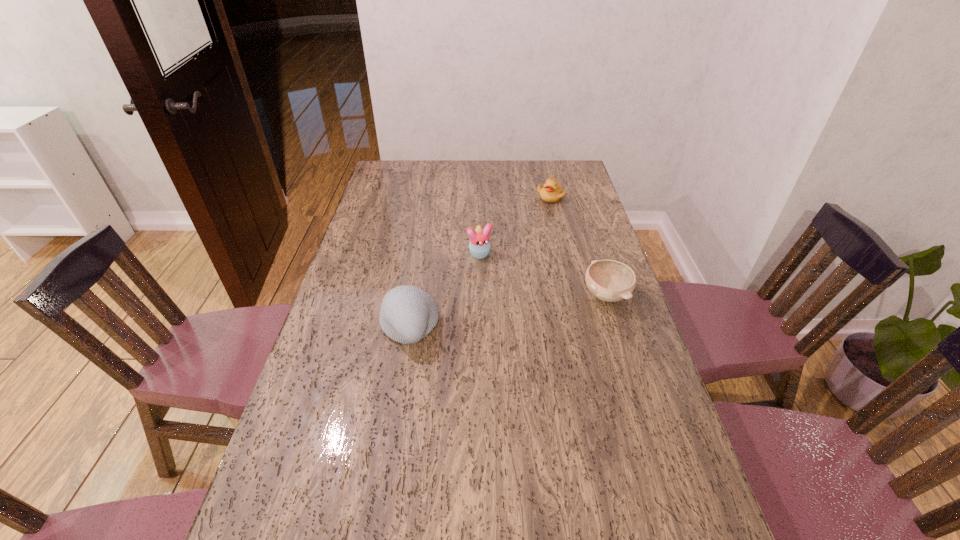
Where is `free space at the far right corner`? This screenshot has width=960, height=540. free space at the far right corner is located at coordinates (571, 160).

Identify the location of free space between the beanie and the duckling. This screenshot has height=540, width=960. (480, 262).

Locate an element on the screen. Image resolution: width=960 pixels, height=540 pixels. vacant space that's between the duckling and the beanie is located at coordinates pyautogui.click(x=480, y=262).

You are a GUI agent. You are given a task and a screenshot of the screen. Output one action in this format:
    pyautogui.click(x=<x>, y=<y>)
    Task: Click on the empty space that is in between the leftmost object and the farthest object
    The height and width of the screenshot is (540, 960).
    Given the screenshot: What is the action you would take?
    pyautogui.click(x=480, y=262)

Locate an element on the screen. The width and height of the screenshot is (960, 540). empty space between the bowl and the cupcake is located at coordinates (543, 275).

You are a GUI agent. You are given a task and a screenshot of the screen. Output one action in this format:
    pyautogui.click(x=<x>, y=<y>)
    Task: Click on the vacant area that lies between the duckling and the bowl
    The image size is (960, 540).
    Given the screenshot: What is the action you would take?
    pyautogui.click(x=578, y=246)

Identify the location of vacant space that's between the bowl and the duckling. (578, 246).

This screenshot has height=540, width=960. I want to click on vacant point located between the second farthest object and the duckling, so click(516, 226).

At what (x,y) coordinates should I click in order to perform the action: click on free point between the beanie and the third nearest object. Please return your answer as a coordinate pair (x, y). Looking at the image, I should click on (444, 291).

Locate an element on the screen. The height and width of the screenshot is (540, 960). free space that is in between the farthest object and the bowl is located at coordinates (578, 246).